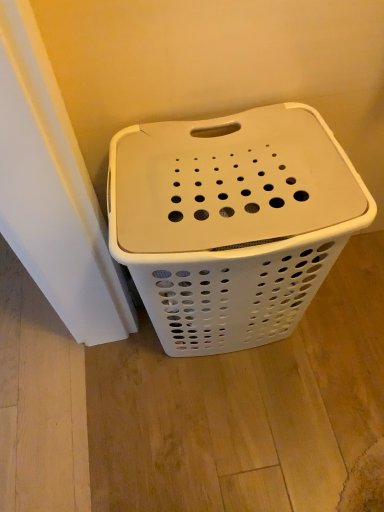
At what (x,y) coordinates should I click in order to perform the action: click on vacant area that is in front of white plastic laundry basket at center. Please return your answer as a coordinate pair (x, y). Looking at the image, I should click on (237, 436).